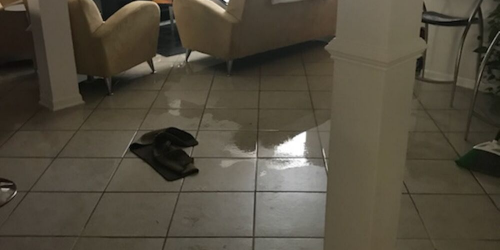
Find the location of a particular element. The width and height of the screenshot is (500, 250). bottom of chair is located at coordinates (8, 190).